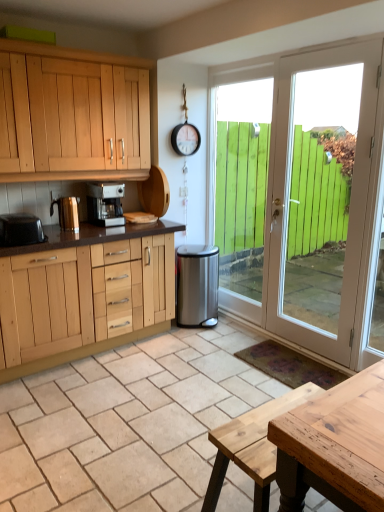
Locate an element on the screen. The width and height of the screenshot is (384, 512). vacant space in front of stainless steel trash can at center, acting as the 3th appliance starting from the front is located at coordinates (210, 337).